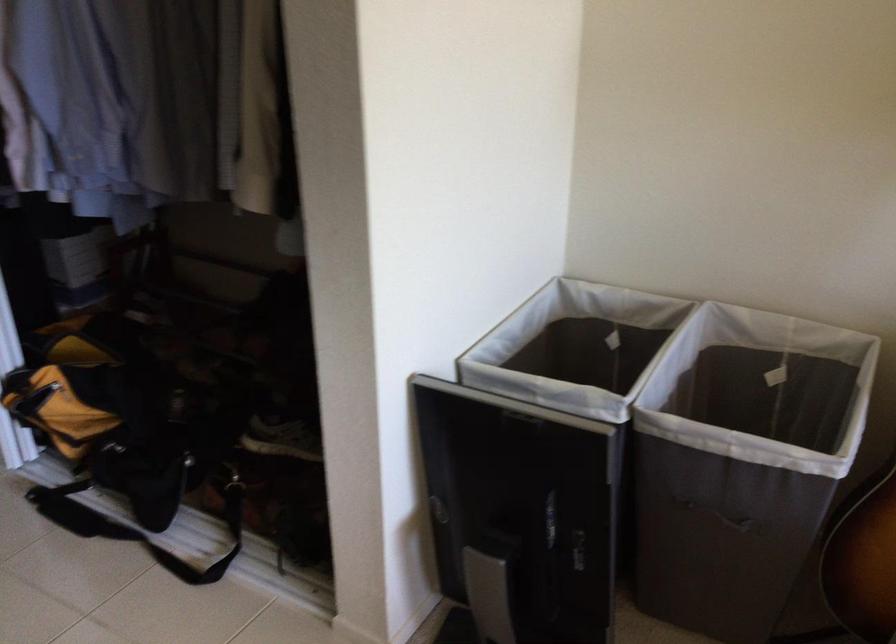
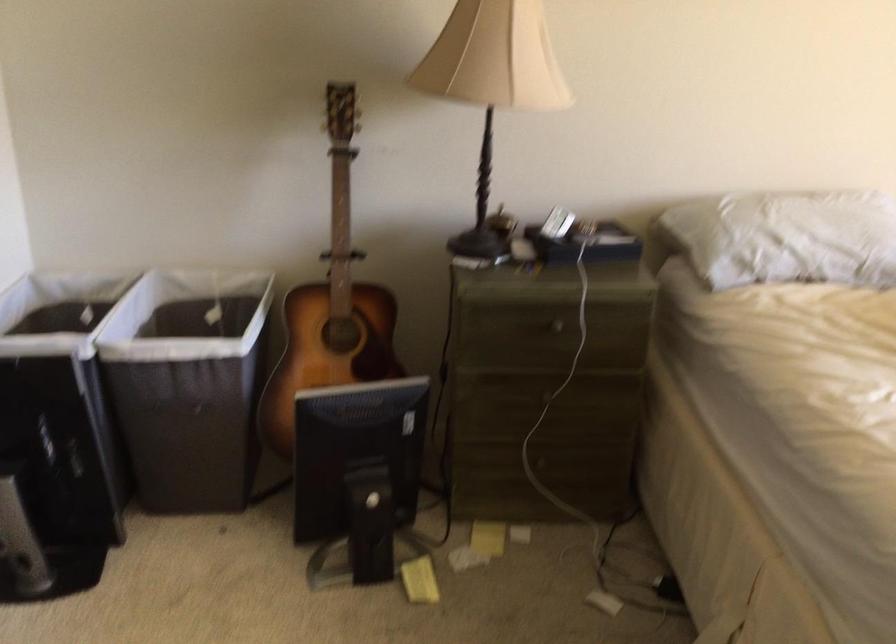
In the second image, find the point that corresponds to [712,507] in the first image.

(181, 406)